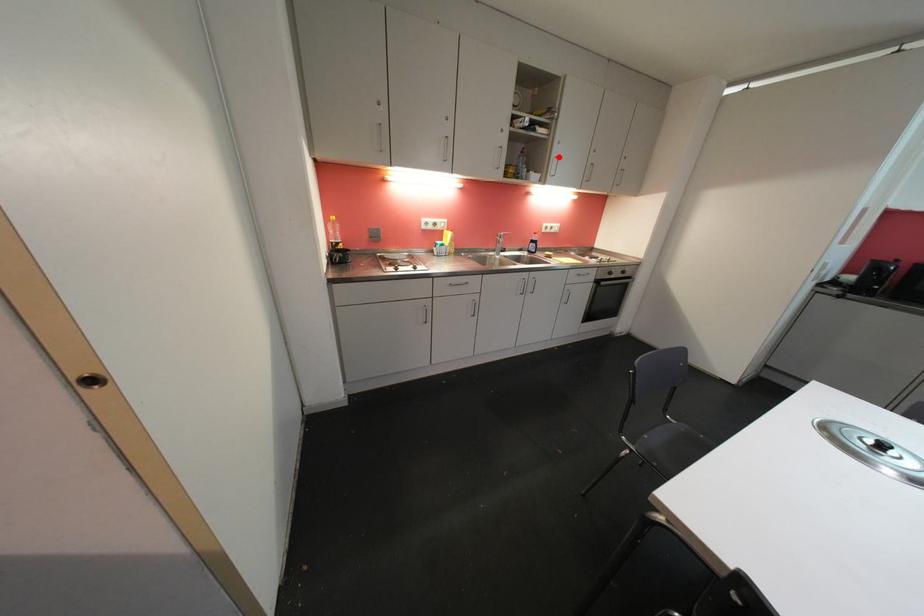
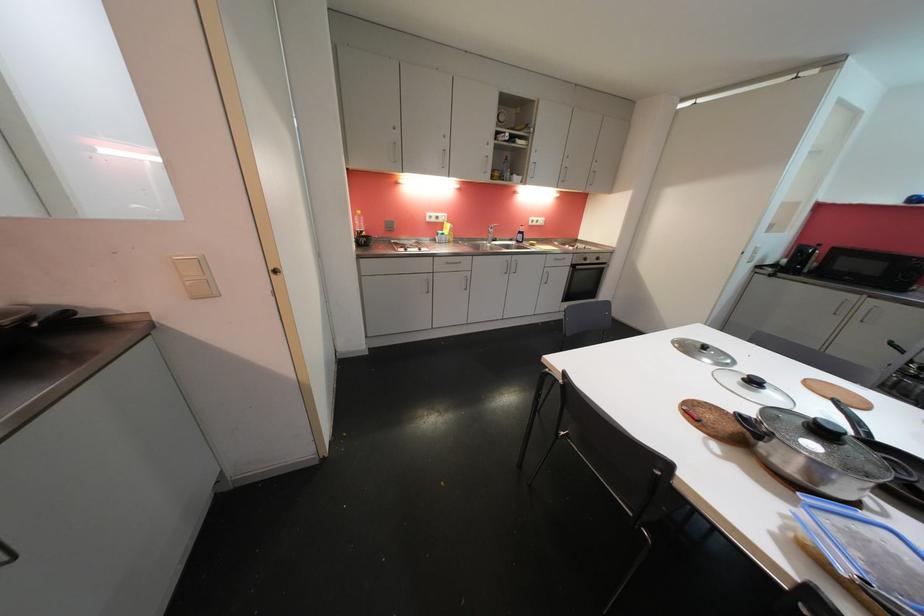
Find the pixel in the second image that matches the highlighted location in the first image.

(537, 163)